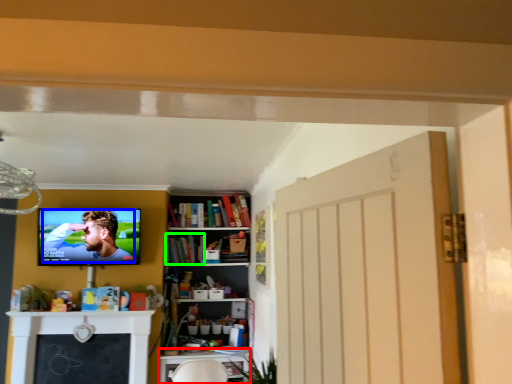
Question: Which object is the closest to the table (highlighted by a red box)? Choose among these: person (highlighted by a blue box) or book (highlighted by a green box).

Choices:
 (A) person
 (B) book

Answer: (B)